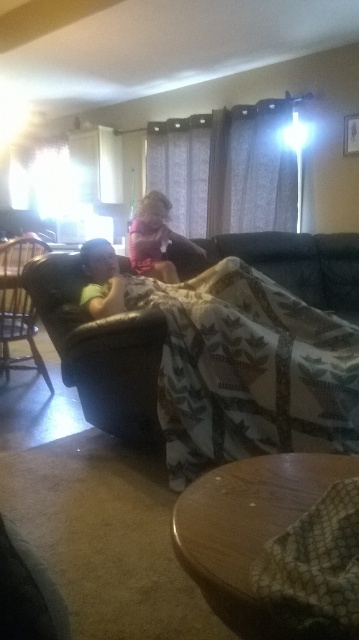
Between point (16, 333) and point (162, 273), which one is positioned behind?

The point (16, 333) is behind.

Can you confirm if dark brown leather armchair at left is bigger than pink fabric at center?

Yes.

Does point (34, 241) come closer to viewer compared to point (142, 212)?

Yes, point (34, 241) is closer to viewer.

Where is `dark brown leather armchair at left`? The width and height of the screenshot is (359, 640). dark brown leather armchair at left is located at coordinates (19, 307).

Which is more to the right, brown quilted blanket at center or dark brown leather armchair at left?

brown quilted blanket at center

Who is positioned more to the left, brown quilted blanket at center or dark brown leather armchair at left?

From the viewer's perspective, dark brown leather armchair at left appears more on the left side.

Between point (229, 401) and point (2, 273), which one is positioned behind?

Positioned behind is point (2, 273).

I want to click on brown quilted blanket at center, so coord(248,371).

Can you confirm if brown quilted blanket at center is shorter than pink fabric at center?

No.

Who is taller, brown quilted blanket at center or pink fabric at center?

With more height is brown quilted blanket at center.

Is point (285, 440) in front of point (148, 272)?

Yes, it is.

Where is `brown quilted blanket at center`? The width and height of the screenshot is (359, 640). brown quilted blanket at center is located at coordinates (248, 371).